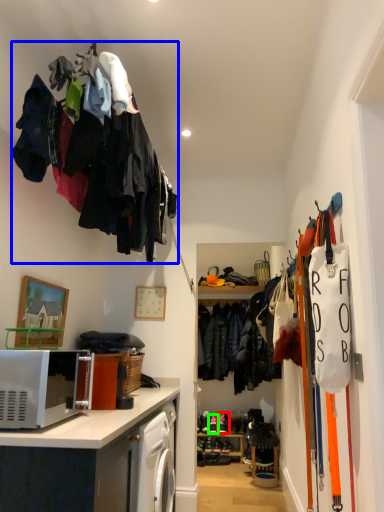
Question: Considering the real-world distances, which object is closest to footwear (highlighted by a red box)? clothing (highlighted by a blue box) or footwear (highlighted by a green box).

Choices:
 (A) clothing
 (B) footwear

Answer: (B)